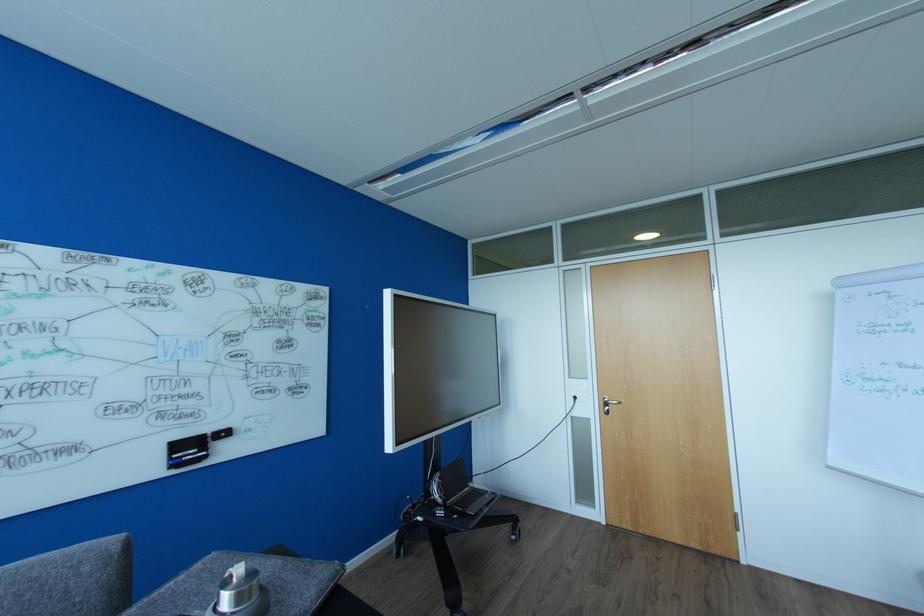
Where would you plugg the wall power socket? Please return your answer as a coordinate pair (x, y).

(578, 391)